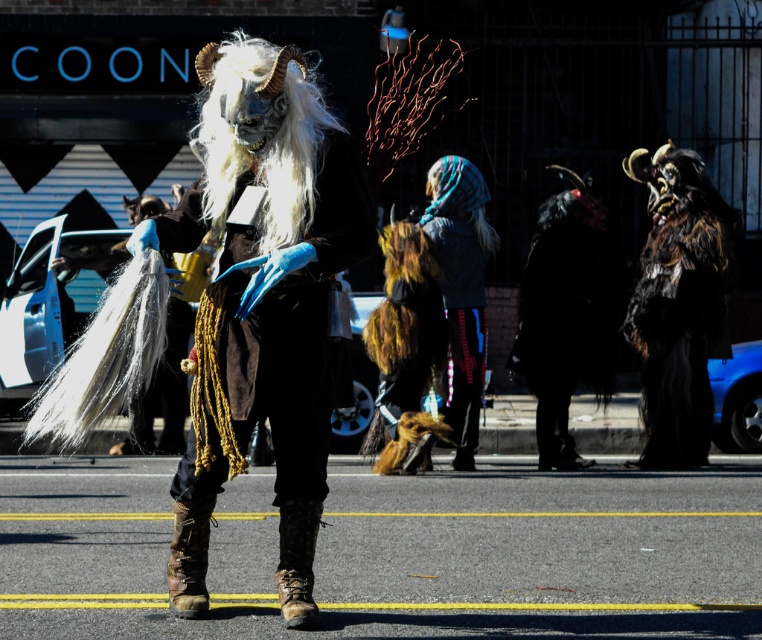
Is point (682, 413) positioned in front of point (463, 189)?

No, it is behind (463, 189).

Between fuzzy black fur at right and plaid wool scarf at center, which one appears on the left side from the viewer's perspective?

plaid wool scarf at center is more to the left.

Which is in front, point (658, 419) or point (443, 182)?

Point (443, 182) is in front.

At what (x,y) coordinates should I click in order to perform the action: click on fuzzy black fur at right. Please return your answer as a coordinate pair (x, y). Looking at the image, I should click on (677, 305).

Does white woolen wig at center have a greater height compared to brown leather cowboy boot at lower center?

In fact, white woolen wig at center may be shorter than brown leather cowboy boot at lower center.

Does white woolen wig at center have a smaller size compared to brown leather cowboy boot at lower center?

Correct, white woolen wig at center occupies less space than brown leather cowboy boot at lower center.

You are a GUI agent. You are given a task and a screenshot of the screen. Output one action in this format:
    pyautogui.click(x=<x>, y=<y>)
    Task: Click on the white woolen wig at center
    
    Given the screenshot: What is the action you would take?
    pyautogui.click(x=258, y=140)

Who is lower down, white woolen wig at center or plaid wool scarf at center?

plaid wool scarf at center

Who is positioned more to the right, white woolen wig at center or plaid wool scarf at center?

Positioned to the right is plaid wool scarf at center.

Where is `white woolen wig at center`? white woolen wig at center is located at coordinates (258, 140).